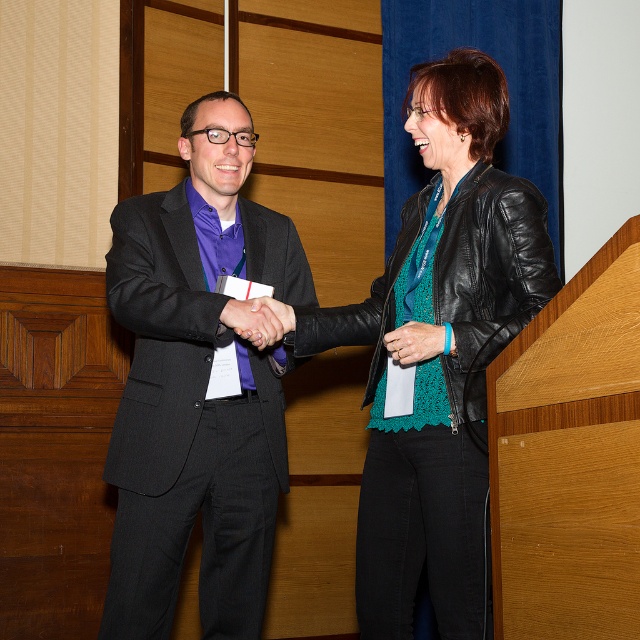
Question: Estimate the real-world distances between objects in this image. Which object is closer to the black leather jacket at center?

Choices:
 (A) matte black leather at center
 (B) matte black hand at center

Answer: (A)

Question: Is matte black hand at center in front of matte black leather at center?

Choices:
 (A) no
 (B) yes

Answer: (A)

Question: Is matte black suit at center positioned in front of black leather jacket at center?

Choices:
 (A) no
 (B) yes

Answer: (A)

Question: Which point is closer to the camera?

Choices:
 (A) matte black suit at center
 (B) black leather jacket at center
 (C) matte black leather at center

Answer: (B)

Question: Which point is closer to the camera taking this photo?

Choices:
 (A) (404, 342)
 (B) (115, 449)
 (C) (308, 324)

Answer: (A)

Question: Is matte black suit at center positioned at the back of matte black hand at center?

Choices:
 (A) yes
 (B) no

Answer: (A)